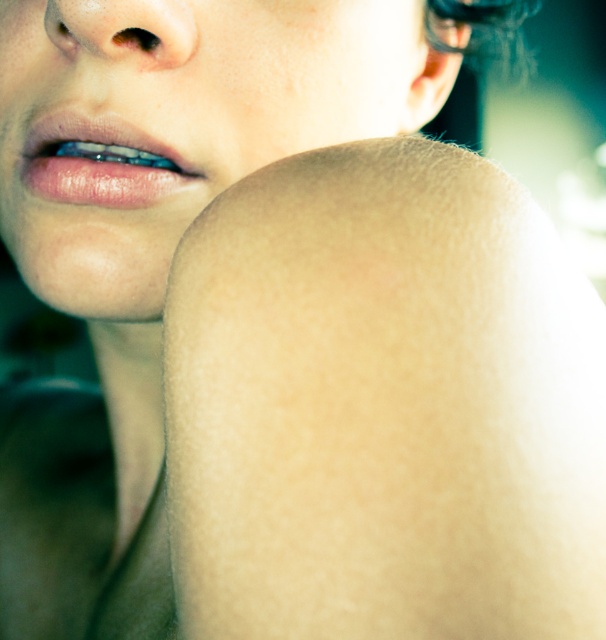
Who is taller, smooth skin at lower left or dark brown hair at upper center?

With more height is dark brown hair at upper center.

Who is higher up, smooth skin at lower left or dark brown hair at upper center?

Positioned higher is dark brown hair at upper center.

This screenshot has height=640, width=606. What do you see at coordinates (173, 122) in the screenshot?
I see `smooth skin at lower left` at bounding box center [173, 122].

Image resolution: width=606 pixels, height=640 pixels. Find the location of `smooth skin at lower left`. smooth skin at lower left is located at coordinates (173, 122).